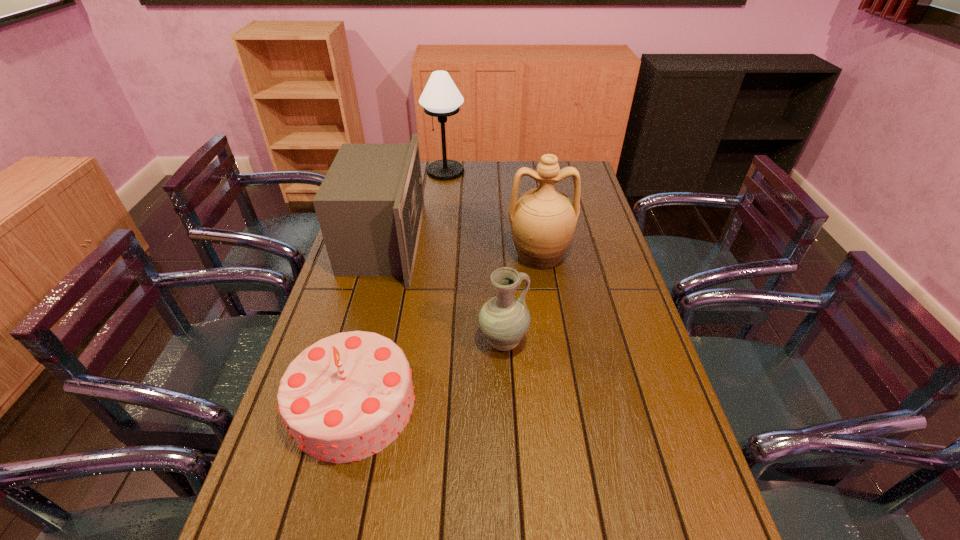
Where is `vacant space in between the taller pitcher and the birthday cake`? vacant space in between the taller pitcher and the birthday cake is located at coordinates (446, 329).

Find the location of a particular element. free spot between the farthest object and the shorter pitcher is located at coordinates (474, 256).

Identify the location of vacant area that lies between the farthest object and the farther pitcher. tap(492, 213).

In order to click on free space between the shorter pitcher and the third shortest object in this screenshot , I will do `click(444, 292)`.

You are a GUI agent. You are given a task and a screenshot of the screen. Output one action in this format:
    pyautogui.click(x=<x>, y=<y>)
    Task: Click on the object that stands as the fourth closest to the third tallest object
    
    Given the screenshot: What is the action you would take?
    pyautogui.click(x=543, y=220)

Identify the location of object that stands as the second closest to the farther pitcher. (370, 205).

This screenshot has width=960, height=540. What are the coordinates of `free spot that satisfies the following two spatial constraints: 1. on the front-facing side of the microwave oven; 2. on the left side of the taller pitcher` in the screenshot? It's located at (380, 255).

Identify the location of vacant space that satisfies the following two spatial constraints: 1. on the front-facing side of the third tallest object; 2. on the left side of the birthday cake. (341, 404).